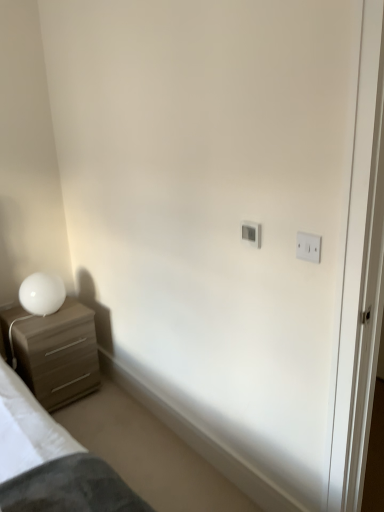
This screenshot has height=512, width=384. Find the location of `free spot above matte wood chest of drawers at left (from a real-world perspective)`. free spot above matte wood chest of drawers at left (from a real-world perspective) is located at coordinates (54, 316).